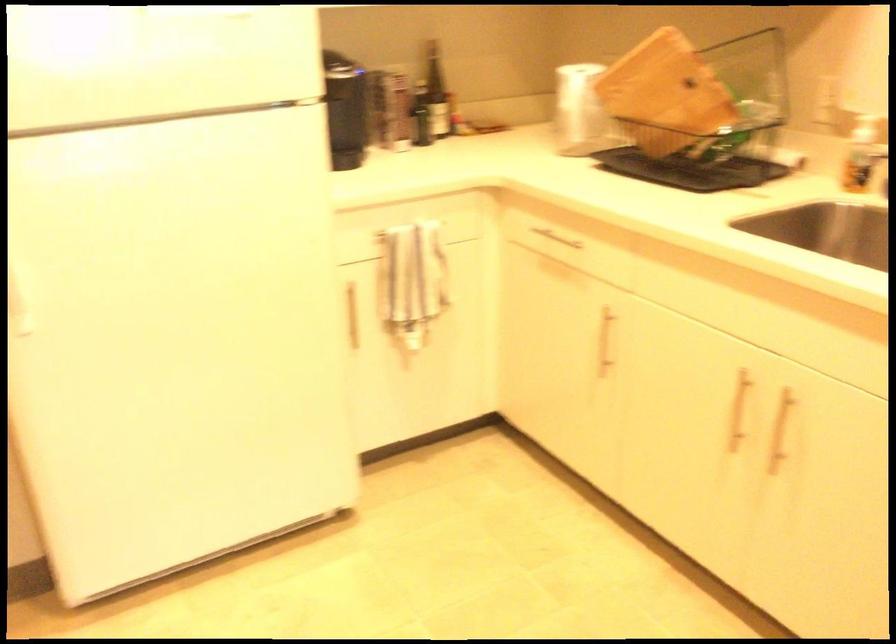
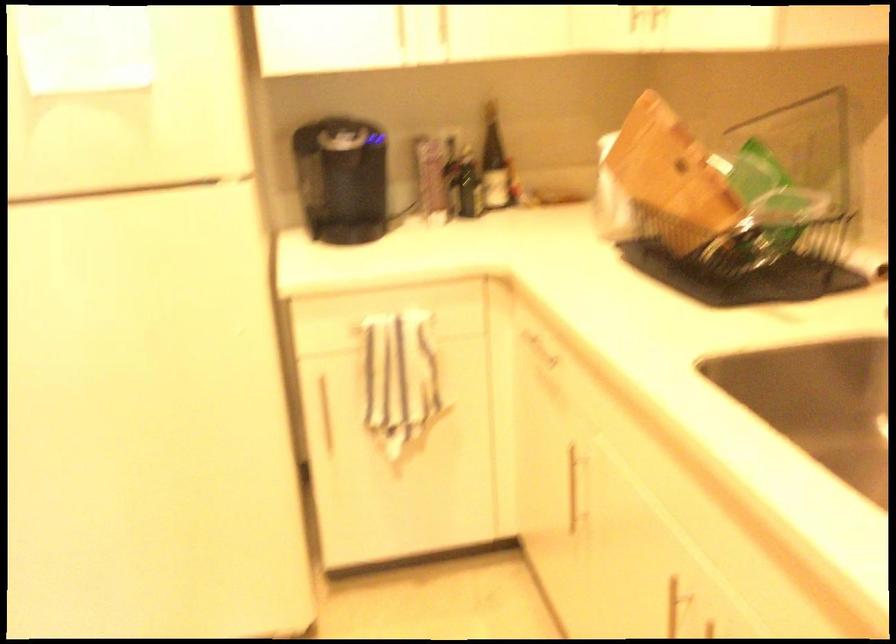
Where in the second image is the point corresponding to [426,91] from the first image?

(494, 163)